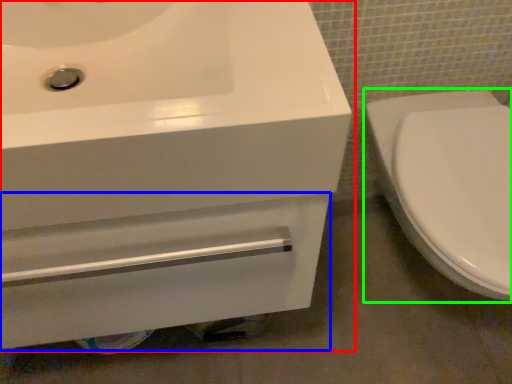
Question: Which is nearer to the sink (highlighted by a red box)? drawer (highlighted by a blue box) or toilet (highlighted by a green box).

Choices:
 (A) drawer
 (B) toilet

Answer: (A)